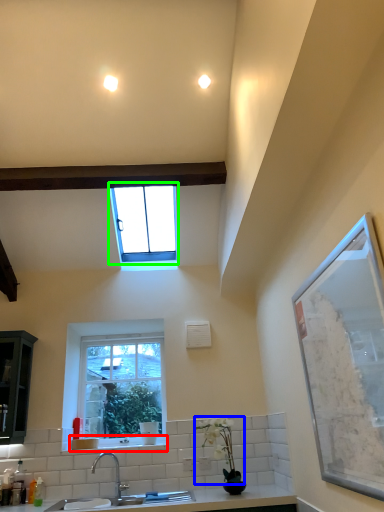
Question: Which object is positioned closest to window sill (highlighted by a red box)? Select from plant (highlighted by a blue box) and window (highlighted by a green box).

Choices:
 (A) plant
 (B) window

Answer: (A)